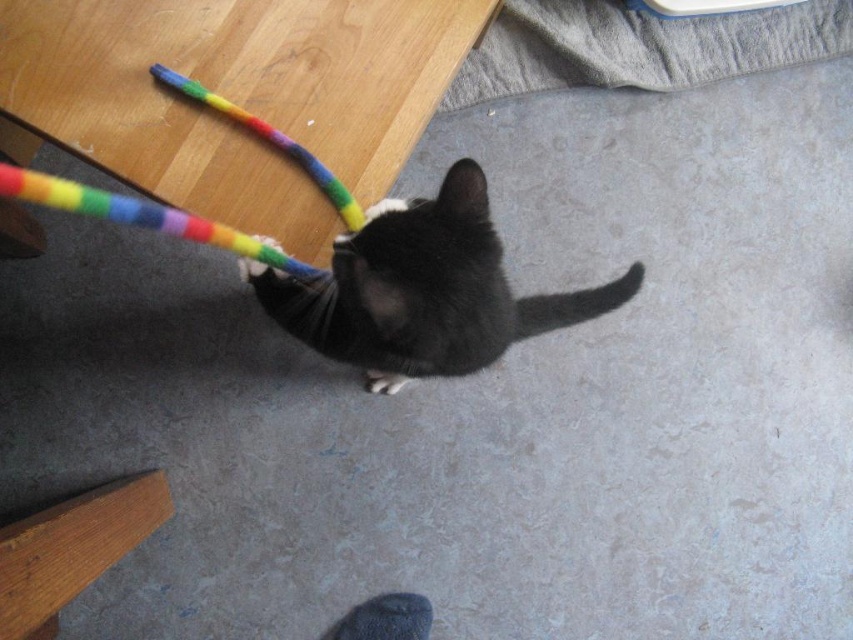
You are a photographer setting up a shoot in this room. You want to place a small stool between the black matte fur cat at center and the soft gray fabric at upper center. Based on their positions, which side of the stool should face the cat?

The stool should have its right side facing the black matte fur cat at center because the cat is on the left side of the soft gray fabric at upper center, so placing the stool between them would require the stool to be positioned such that its right side faces the cat and the left side faces the fabric.

You are a photographer setting up a camera to capture the black matte fur cat at center. The camera is placed at the origin point of the coordinate system. Based on the cat position, which direction should you adjust the camera to aim directly at the cat?

The black matte fur cat at center is located at coordinates approximately 0.455 on the x and 0.497 on the y. Since the origin is at (0, 0), the cat is to the right and slightly above the camera. To aim directly at the cat, the camera should be adjusted to the right and slightly upward.

In the scene shown: You are trying to place a small plant pot on the floor near the soft gray fabric at upper center. Based on the coordinates provided in the Objects Description, can you determine if the plant pot will fit in that location?

The soft gray fabric at upper center is located at point [639,45], so yes, the plant pot can be placed there as the coordinates indicate a specific position on the floor.